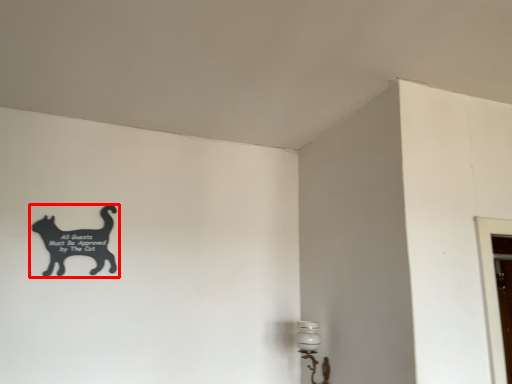
Question: From the image's perspective, what is the correct spatial relationship of cat (annotated by the red box) in relation to lamp?

Choices:
 (A) below
 (B) above

Answer: (B)